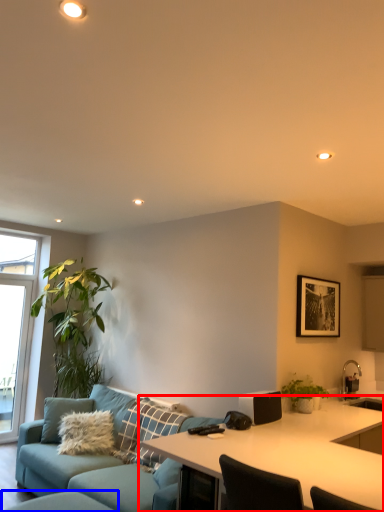
Question: Which point is closer to the camera, desk (highlighted by a red box) or swivel chair (highlighted by a blue box)?

Choices:
 (A) desk
 (B) swivel chair

Answer: (A)